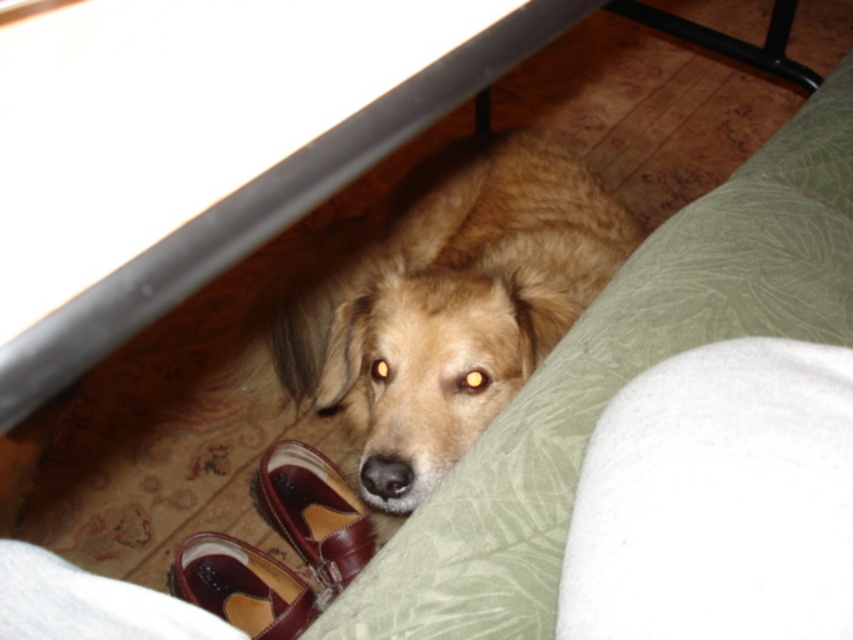
Question: Does golden fur dog at center appear over brown leather shoe at lower center?

Choices:
 (A) yes
 (B) no

Answer: (A)

Question: Which of the following is the farthest from the observer?

Choices:
 (A) golden fur dog at center
 (B) brown leather shoe at lower center

Answer: (B)

Question: Which point is farther to the camera?

Choices:
 (A) golden fur dog at center
 (B) brown leather shoe at lower center

Answer: (B)

Question: Which point is closer to the camera taking this photo?

Choices:
 (A) (332, 483)
 (B) (397, 356)

Answer: (B)

Question: Does golden fur dog at center have a smaller size compared to brown leather shoe at lower center?

Choices:
 (A) yes
 (B) no

Answer: (B)

Question: In this image, where is golden fur dog at center located relative to brown leather shoe at lower center?

Choices:
 (A) left
 (B) right

Answer: (B)